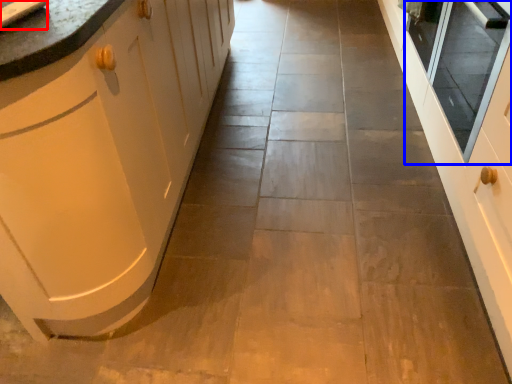
Question: Which of the following is the closest to the observer, sink (highlighted by a red box) or window screen (highlighted by a blue box)?

Choices:
 (A) sink
 (B) window screen

Answer: (A)